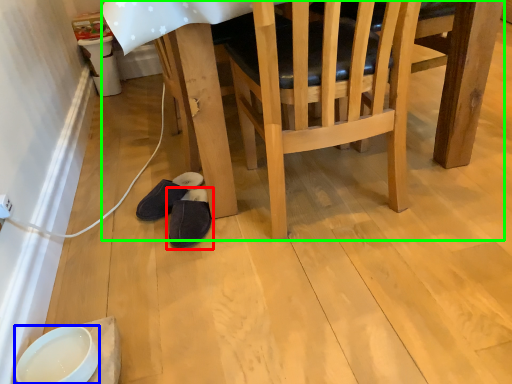
Question: Which object is positioned farthest from footwear (highlighted by a red box)? Select from bowl (highlighted by a blue box) and table (highlighted by a green box).

Choices:
 (A) bowl
 (B) table

Answer: (A)